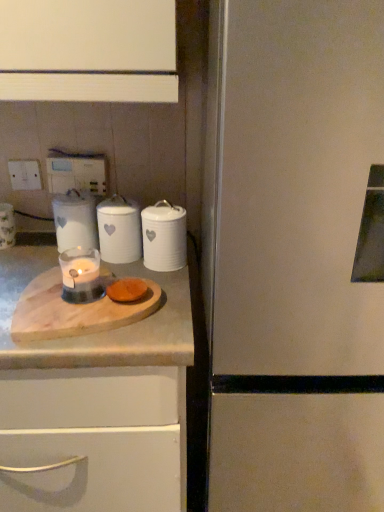
Identify the location of free space in front of white ceramic canister at center, which is counted as the third kitchen appliance, starting from the left. (168, 290).